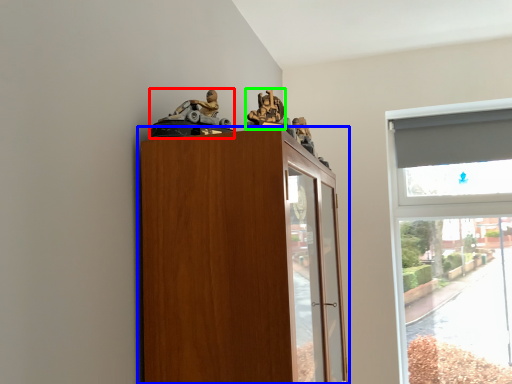
Question: Which object is positioned farthest from toy (highlighted by a red box)? Select from cupboard (highlighted by a blue box) and toy (highlighted by a green box).

Choices:
 (A) cupboard
 (B) toy

Answer: (A)